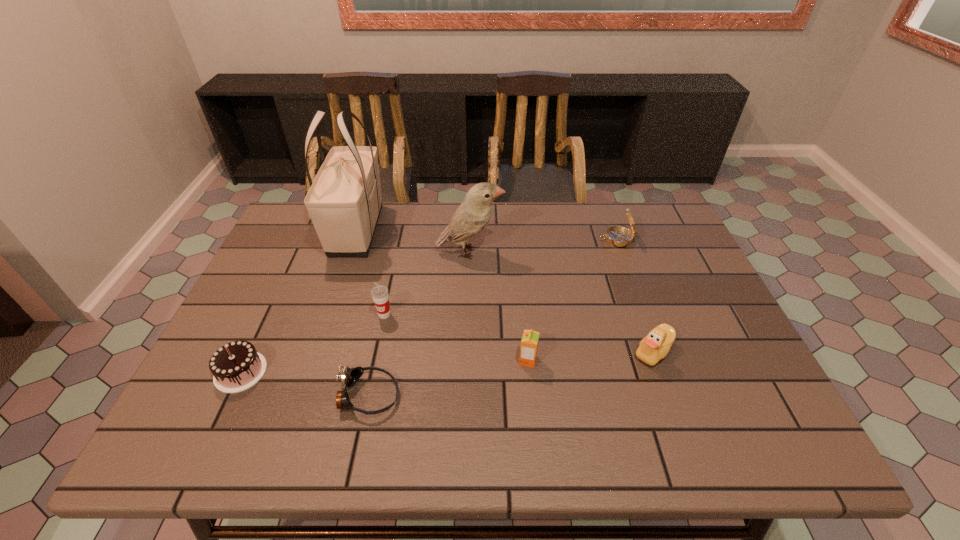
This screenshot has width=960, height=540. What are the coordinates of `vacant space located 0.280m with handles facing forward on the tallest object` in the screenshot? It's located at (320, 339).

The height and width of the screenshot is (540, 960). What are the coordinates of `free spot located 0.090m at the face of the bird` in the screenshot? It's located at tap(534, 252).

Locate an element on the screen. Image resolution: width=960 pixels, height=540 pixels. free space located 0.130m on the side of the fourth farthest object with the logo is located at coordinates (374, 363).

What are the coordinates of `vacant space located with the dial facing the compass` in the screenshot? It's located at (544, 239).

The image size is (960, 540). In order to click on vacant space located with the dial facing the compass in this screenshot , I will do `click(544, 239)`.

The image size is (960, 540). I want to click on free region located 0.310m with the dial facing the compass, so click(499, 239).

Find the location of `vacant position located on the left of the orange juice`. vacant position located on the left of the orange juice is located at coordinates (459, 361).

The height and width of the screenshot is (540, 960). In order to click on blank area located 0.340m at the beak of the duck in this screenshot , I will do `click(489, 352)`.

Where is `free point located 0.360m at the beak of the duck`? This screenshot has height=540, width=960. free point located 0.360m at the beak of the duck is located at coordinates (480, 352).

This screenshot has width=960, height=540. Identify the location of free location located 0.080m at the beak of the duck. (598, 352).